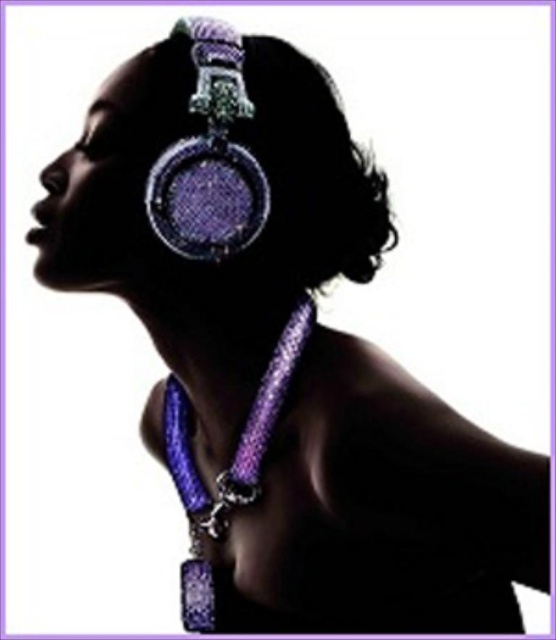
You are an appraiser examining the jewelry from the front. Which of the two items, the sparkly purple earring at upper center or the purple mesh necklace at center, is positioned closer to your line of sight?

The sparkly purple earring at upper center is closer to the viewer than the purple mesh necklace at center, so it is positioned closer to your line of sight.

Consider the image. You are a photographer adjusting the focus on your camera. You want to ensure that the point at coordinates point (x=232, y=33) is in focus. The camera can focus on objects within a 40 inch range. Is the point within the focus range?

The point (x=232, y=33) is 38.14 inches from the camera, which is within the 40 inch focus range. Therefore, the point is within the focus range.

You are standing 40 inches away from the jewelry. Is the point at coordinates point (200, 52) closer to you than the rest of the jewelry?

The distance of point (200, 52) from viewer is 37.27 inches, so yes, the point at coordinates point (200, 52) is closer to you than the rest of the jewelry since you are standing 40 inches away.